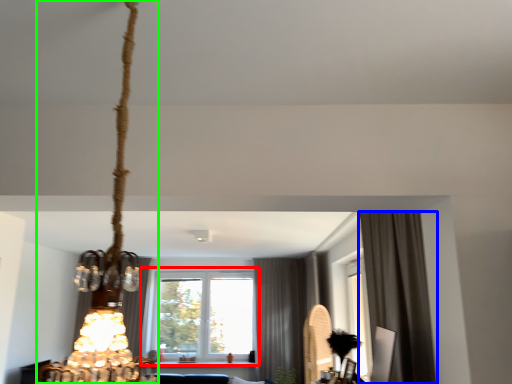
Question: Based on their relative distances, which object is nearer to window (highlighted by a red box)? Choose from curtain (highlighted by a blue box) and lamp (highlighted by a green box).

Choices:
 (A) curtain
 (B) lamp

Answer: (A)